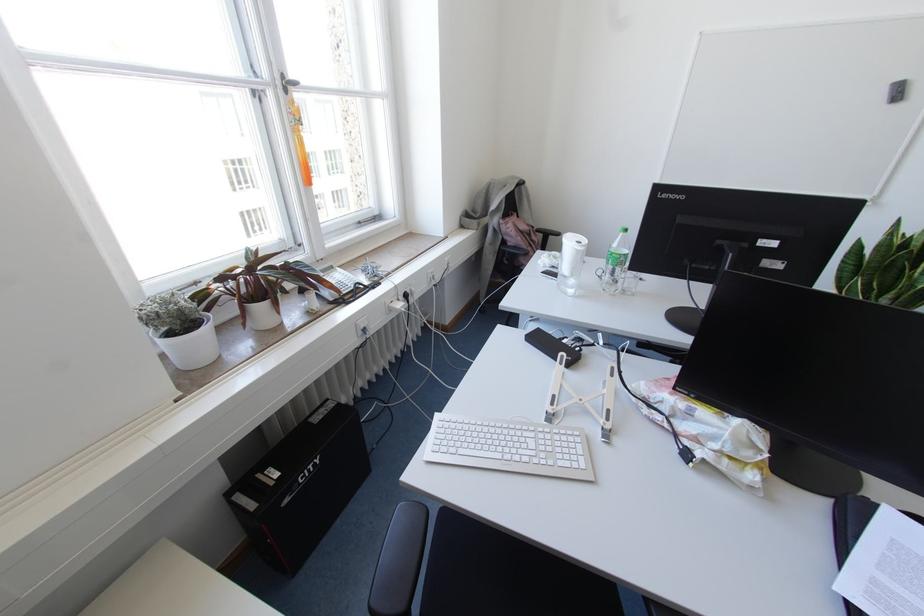
Find where to pull the window handle. Please return your answer as a coordinate pair (x, y).

(287, 83)